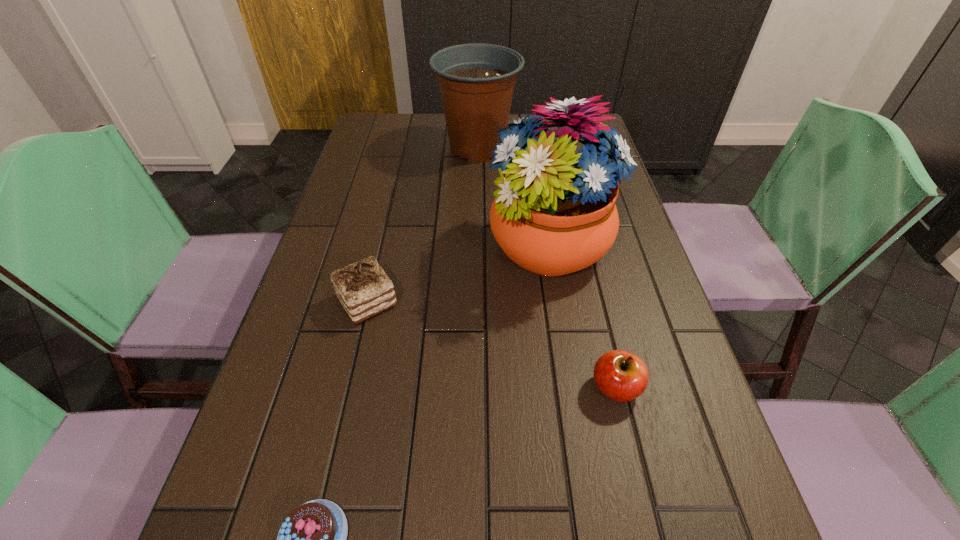
Locate an element on the screen. The width and height of the screenshot is (960, 540). flower arrangement is located at coordinates (554, 214).

Where is `flowerpot`? Image resolution: width=960 pixels, height=540 pixels. flowerpot is located at coordinates [476, 80].

Image resolution: width=960 pixels, height=540 pixels. Find the location of `the second tallest object`. the second tallest object is located at coordinates (476, 80).

At what (x,y) coordinates should I click in order to perform the action: click on the farther chocolate cake. Please return your answer as a coordinate pair (x, y). The width and height of the screenshot is (960, 540). Looking at the image, I should click on (363, 288).

Identify the location of the second nearest object. Image resolution: width=960 pixels, height=540 pixels. (621, 376).

I want to click on free space located on the back of the tallest object, so click(534, 144).

Where is `blank space located 0.180m on the right of the flowerpot`? blank space located 0.180m on the right of the flowerpot is located at coordinates (576, 148).

At what (x,y) coordinates should I click in order to perform the action: click on vacant space located 0.220m on the right of the taller chocolate cake. Please return your answer as a coordinate pair (x, y). The width and height of the screenshot is (960, 540). Looking at the image, I should click on (502, 302).

Locate an element on the screen. This screenshot has height=540, width=960. vacant area situated 0.230m on the back of the fourth farthest object is located at coordinates (589, 279).

Find the location of `object present at the far edge`. object present at the far edge is located at coordinates (476, 80).